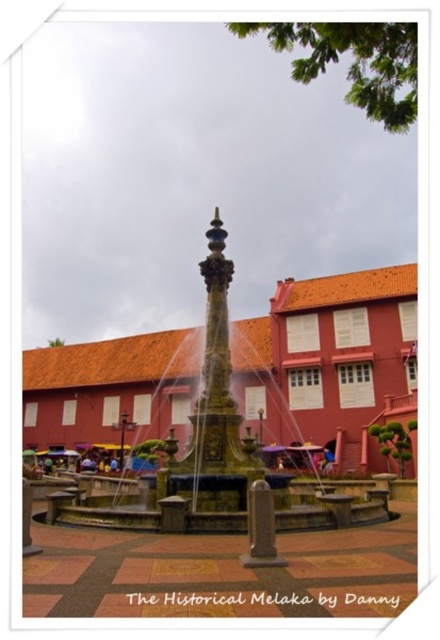
Question: Among these points, which one is farthest from the camera?

Choices:
 (A) (62, 560)
 (B) (227, 262)

Answer: (B)

Question: Estimate the real-world distances between objects in this image. Which object is farther from the brown wooden square at center?

Choices:
 (A) bronze textured fountain at center
 (B) terracotta brick square at lower left

Answer: (A)

Question: Is bronze textured fountain at center to the right of brown wooden square at center from the viewer's perspective?

Choices:
 (A) no
 (B) yes

Answer: (A)

Question: Which of the following is the farthest from the observer?

Choices:
 (A) (77, 561)
 (B) (415, 592)
 (C) (253, 467)

Answer: (C)

Question: Is brown wooden square at center smaller than terracotta brick square at lower left?

Choices:
 (A) yes
 (B) no

Answer: (B)

Question: Can you confirm if bronze textured fountain at center is positioned to the left of brown wooden square at center?

Choices:
 (A) yes
 (B) no

Answer: (A)